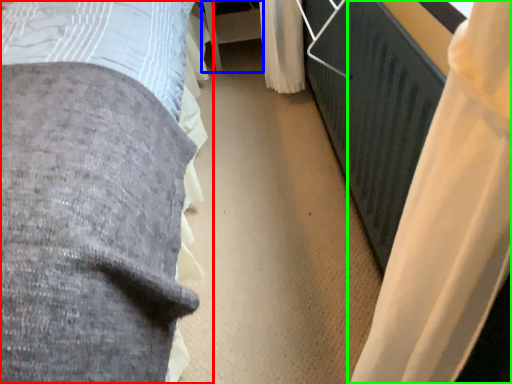
Question: Which object is the closest to the bed (highlighted by a red box)? Choose among these: table (highlighted by a blue box) or curtain (highlighted by a green box).

Choices:
 (A) table
 (B) curtain

Answer: (B)